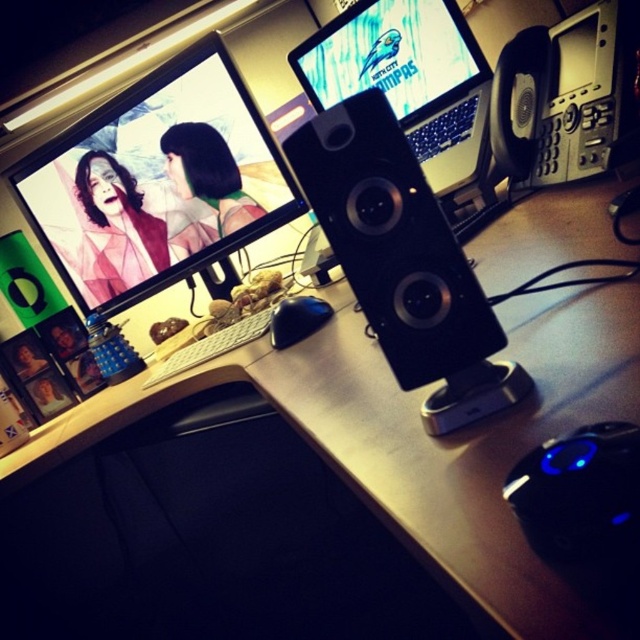
Between white plastic keyboard at center and black matte mouse at center, which one is positioned lower?

white plastic keyboard at center is lower down.

Is white plastic keyboard at center shorter than black matte mouse at center?

Incorrect, white plastic keyboard at center's height does not fall short of black matte mouse at center's.

I want to click on white plastic keyboard at center, so click(x=211, y=346).

Which is in front, point (93, 177) or point (420, 58)?

Point (420, 58) is in front.

Who is lower down, matte black monitor at upper left or matte plastic laptop at upper center?

matte black monitor at upper left is below.

You are a GUI agent. You are given a task and a screenshot of the screen. Output one action in this format:
    pyautogui.click(x=<x>, y=<y>)
    Task: Click on the matte black monitor at upper left
    The image size is (640, 640).
    Given the screenshot: What is the action you would take?
    pyautogui.click(x=156, y=180)

This screenshot has width=640, height=640. Identify the location of matte black monitor at upper left. (156, 180).

Between black plastic speaker at center and matte plastic laptop at upper center, which one is positioned lower?

black plastic speaker at center is lower down.

Does black plastic speaker at center have a larger size compared to matte plastic laptop at upper center?

Actually, black plastic speaker at center might be smaller than matte plastic laptop at upper center.

Which is behind, point (440, 333) or point (442, 88)?

The point (442, 88) is more distant.

Identify the location of black plastic speaker at center. (392, 241).